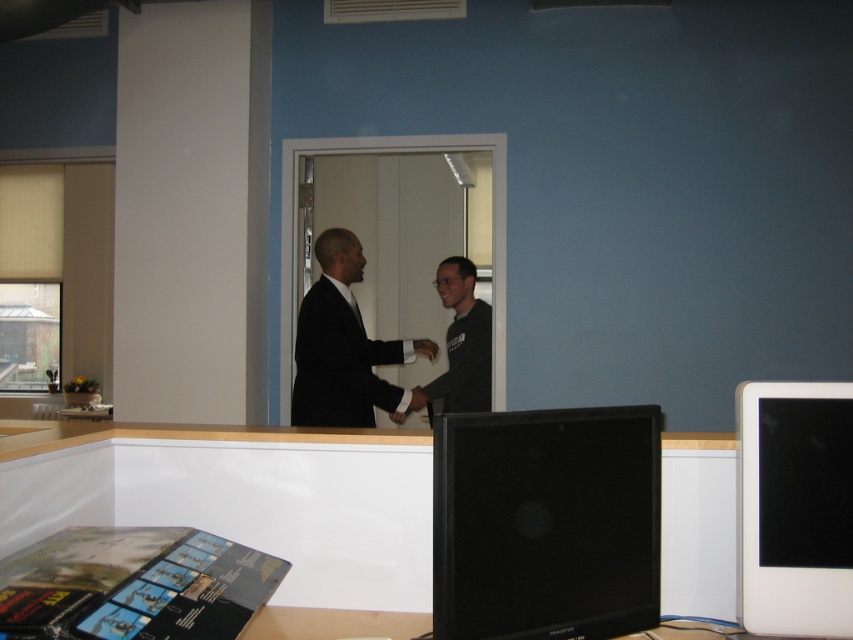
Question: Which is farther from the white glossy monitor at right?

Choices:
 (A) black matte hand at center
 (B) black suit at center
 (C) dark gray sweater at center

Answer: (C)

Question: Is black glossy monitor at center positioned before black suit at center?

Choices:
 (A) yes
 (B) no

Answer: (A)

Question: Which point is farther to the camera?

Choices:
 (A) white glossy monitor at right
 (B) black glossy monitor at center
 (C) black suit at center
 (D) black matte hand at center

Answer: (D)

Question: Which of the following is the farthest from the observer?

Choices:
 (A) (579, 576)
 (B) (349, 284)

Answer: (B)

Question: Does black suit at center have a smaller size compared to black matte hand at center?

Choices:
 (A) no
 (B) yes

Answer: (A)

Question: In this image, where is dark gray sweater at center located relative to black matte hand at center?

Choices:
 (A) above
 (B) below

Answer: (A)